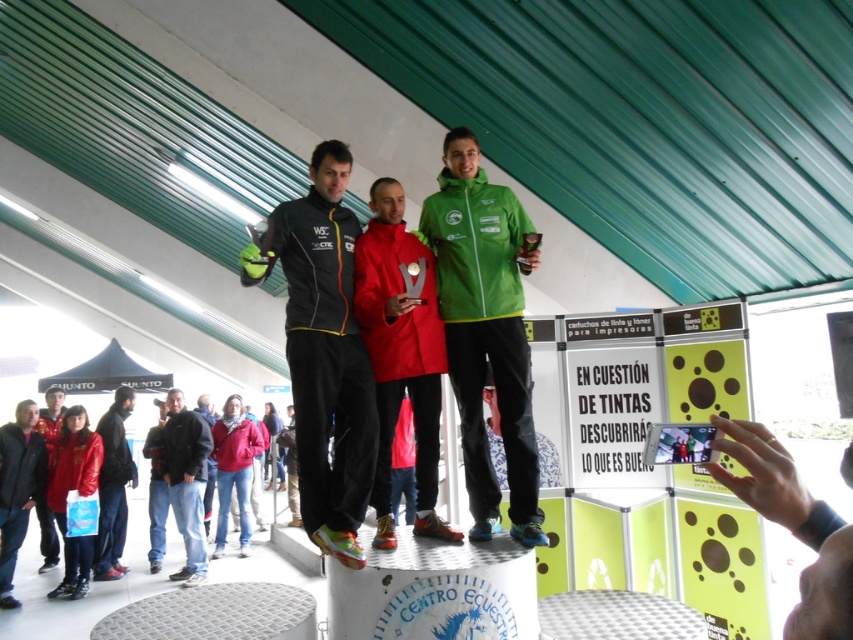
Does matte black jacket at center have a larger size compared to green matte jacket at center?

Correct, matte black jacket at center is larger in size than green matte jacket at center.

Who is more forward, (312, 317) or (471, 179)?

Point (312, 317) is in front.

Does point (347, 221) lie in front of point (538, 467)?

That is True.

The width and height of the screenshot is (853, 640). I want to click on matte black jacket at center, so click(323, 352).

Is point (73, 592) positioned behind point (119, 432)?

No, (73, 592) is in front of (119, 432).

Does point (61, 429) come closer to viewer compared to point (107, 513)?

No.

Image resolution: width=853 pixels, height=640 pixels. Identify the location of matte red jacket at lower left. (77, 492).

Is point (181, 474) closer to camera compared to point (47, 547)?

Yes.

Between point (187, 525) and point (48, 448), which one is positioned behind?

The point (48, 448) is behind.

Between point (193, 525) and point (51, 451), which one is positioned in front?

Point (193, 525) is more forward.

Find the location of a particular element. dark blue jacket at center is located at coordinates (184, 481).